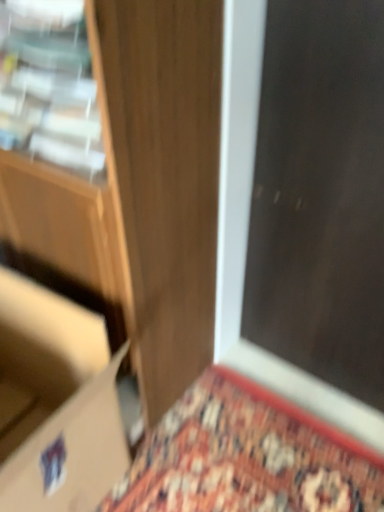
Find the location of a particular element. This screenshot has width=384, height=512. matte cardboard box at lower left is located at coordinates (61, 400).

Where is `wooden door at center`? wooden door at center is located at coordinates (163, 178).

Image resolution: width=384 pixels, height=512 pixels. I want to click on matte cardboard box at lower left, so click(x=61, y=400).

From a real-world perspective, is matte cardboard box at lower left beneath wooden door at center?

Indeed, from a real-world perspective, matte cardboard box at lower left is positioned beneath wooden door at center.

How many degrees apart are the facing directions of matte cardboard box at lower left and wooden door at center?

2.96 degrees.

Which is less distant, (x=42, y=291) or (x=147, y=186)?

Clearly, point (x=42, y=291) is more distant from the camera than point (x=147, y=186).

Is wooden door at center at the back of matte cardboard box at lower left?

That's right, matte cardboard box at lower left is facing away from wooden door at center.

Can you confirm if matte cardboard box at lower left is wider than dark wood screen door at upper right?

In fact, matte cardboard box at lower left might be narrower than dark wood screen door at upper right.

Consider the image. Considering their positions, is matte cardboard box at lower left located in front of or behind dark wood screen door at upper right?

matte cardboard box at lower left is positioned closer to the viewer than dark wood screen door at upper right.

How much distance is there between matte cardboard box at lower left and dark wood screen door at upper right?

matte cardboard box at lower left and dark wood screen door at upper right are 27.15 inches apart from each other.

Is matte cardboard box at lower left next to dark wood screen door at upper right?

matte cardboard box at lower left and dark wood screen door at upper right are clearly separated.

From the image's perspective, relative to matte cardboard box at lower left, is wooden door at center above or below?

wooden door at center is above matte cardboard box at lower left.

Is wooden door at center far away from matte cardboard box at lower left?

No, there isn't a large distance between wooden door at center and matte cardboard box at lower left.

Is wooden door at center looking in the opposite direction of matte cardboard box at lower left?

No, wooden door at center is not facing the opposite direction of matte cardboard box at lower left.

From the image's perspective, is wooden door at center over dark wood screen door at upper right?

Yes.

Where is `screen door lying below the wooden door at center (from the image's perspective)`? screen door lying below the wooden door at center (from the image's perspective) is located at coordinates (320, 194).

Relative to dark wood screen door at upper right, is wooden door at center in front or behind?

wooden door at center is in front of dark wood screen door at upper right.

How far apart are wooden door at center and dark wood screen door at upper right?

A distance of 32.03 centimeters exists between wooden door at center and dark wood screen door at upper right.

Considering the relative sizes of dark wood screen door at upper right and matte cardboard box at lower left in the image provided, is dark wood screen door at upper right taller than matte cardboard box at lower left?

Indeed, dark wood screen door at upper right has a greater height compared to matte cardboard box at lower left.

From a real-world perspective, between dark wood screen door at upper right and matte cardboard box at lower left, who is vertically higher?

In real-world perspective, dark wood screen door at upper right is above.

Are dark wood screen door at upper right and matte cardboard box at lower left located far from each other?

No, dark wood screen door at upper right is not far away from matte cardboard box at lower left.

From a real-world perspective, is dark wood screen door at upper right on top of wooden door at center?

No, from a real-world perspective, dark wood screen door at upper right is not on top of wooden door at center.

Consider the image. Who is smaller, dark wood screen door at upper right or wooden door at center?

dark wood screen door at upper right.

Considering the positions of objects dark wood screen door at upper right and wooden door at center in the image provided, who is in front, dark wood screen door at upper right or wooden door at center?

wooden door at center is more forward.

Is dark wood screen door at upper right to the left or to the right of wooden door at center in the image?

Based on their positions, dark wood screen door at upper right is located to the right of wooden door at center.

Identify the location of cardboard box that is on the left side of wooden door at center. (61, 400).

Find the location of a particular element. cardboard box that is below the dark wood screen door at upper right (from the image's perspective) is located at coordinates (61, 400).

When comparing their distances from wooden door at center, does matte cardboard box at lower left or dark wood screen door at upper right seem further?

Among the two, dark wood screen door at upper right is located further to wooden door at center.

From the image, which object appears to be nearer to wooden door at center, dark wood screen door at upper right or matte cardboard box at lower left?

matte cardboard box at lower left.

Estimate the real-world distances between objects in this image. Which object is further from dark wood screen door at upper right, matte cardboard box at lower left or wooden door at center?

matte cardboard box at lower left lies further to dark wood screen door at upper right than the other object.

Looking at the image, which one is located further to matte cardboard box at lower left, dark wood screen door at upper right or wooden door at center?

dark wood screen door at upper right is positioned further to the anchor matte cardboard box at lower left.

Estimate the real-world distances between objects in this image. Which object is further from dark wood screen door at upper right, wooden door at center or matte cardboard box at lower left?

matte cardboard box at lower left is further to dark wood screen door at upper right.

Looking at the image, which one is located closer to matte cardboard box at lower left, wooden door at center or dark wood screen door at upper right?

wooden door at center lies closer to matte cardboard box at lower left than the other object.

In order to click on door between matte cardboard box at lower left and dark wood screen door at upper right from left to right in this screenshot , I will do `click(163, 178)`.